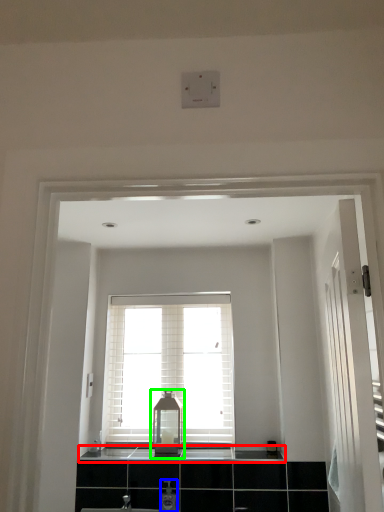
Question: Considering the real-world distances, which object is farthest from counter top (highlighted by a red box)? toiletry (highlighted by a blue box) or medicine cabinet (highlighted by a green box)?

Choices:
 (A) toiletry
 (B) medicine cabinet

Answer: (A)